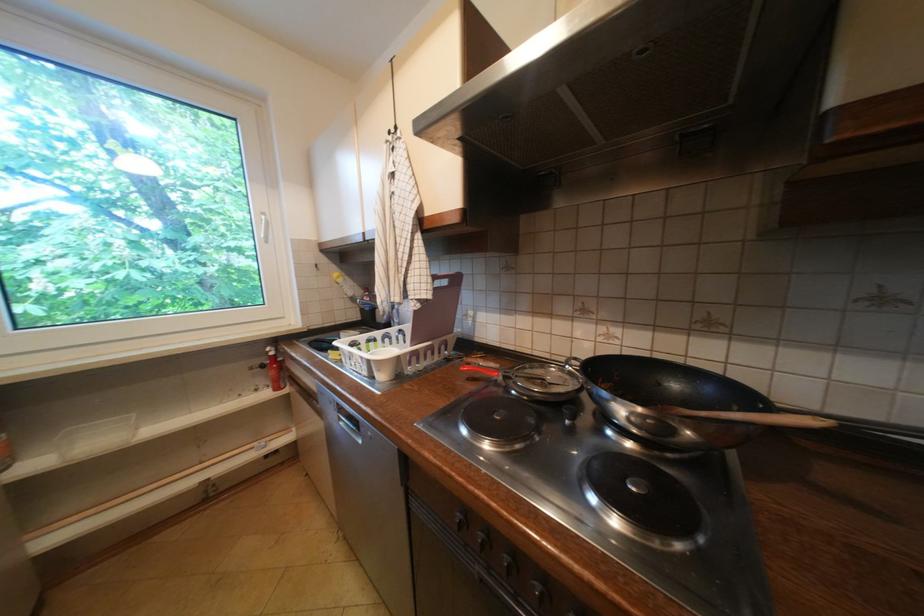
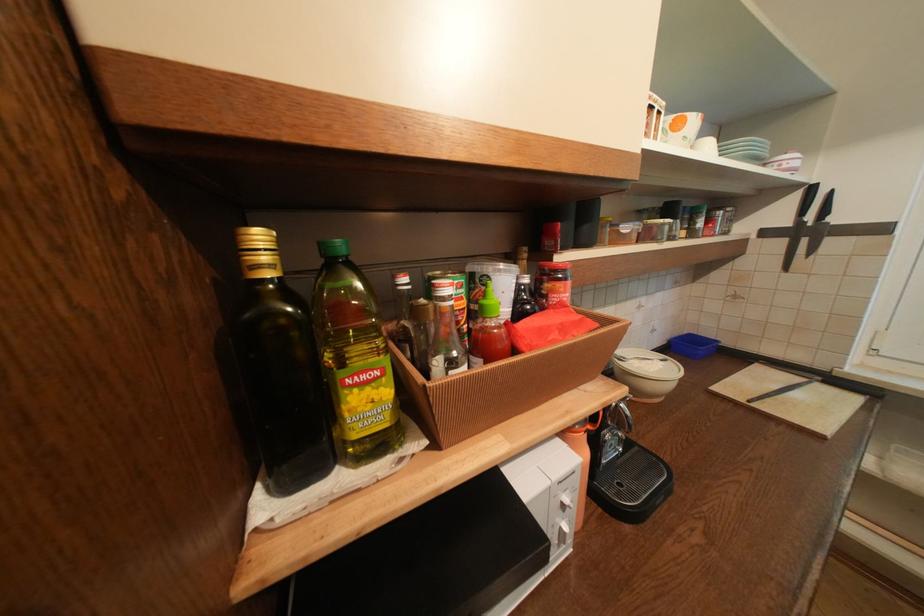
Based on the continuous images, in which direction is the camera rotating?

The camera's rotation is toward left-down.